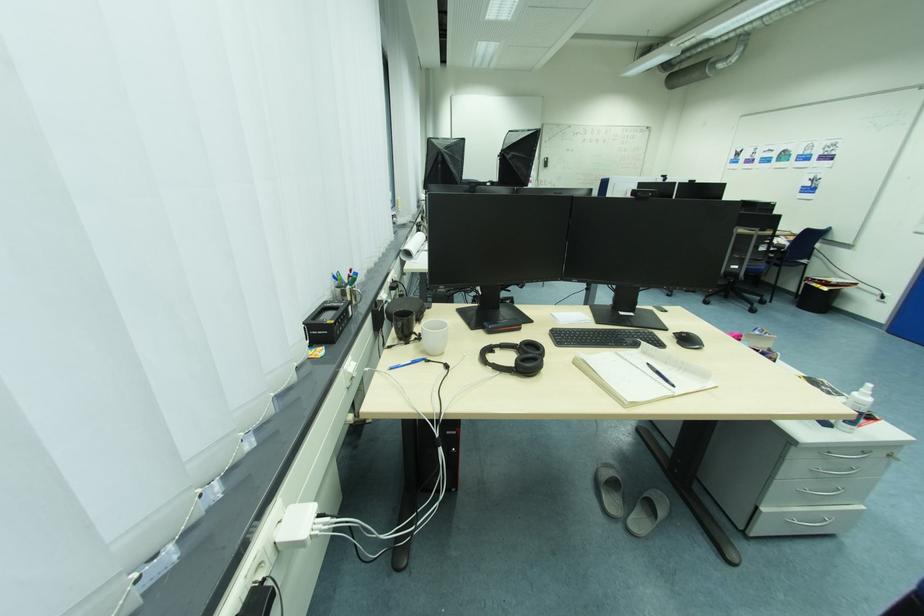
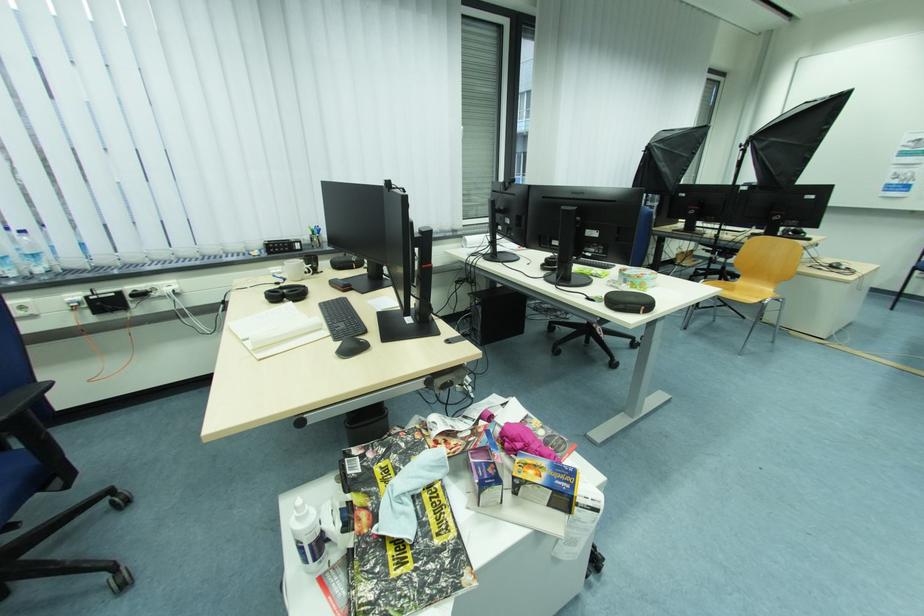
Find the pixel in the second image that matches the point at 454,368 in the first image.

(284, 285)